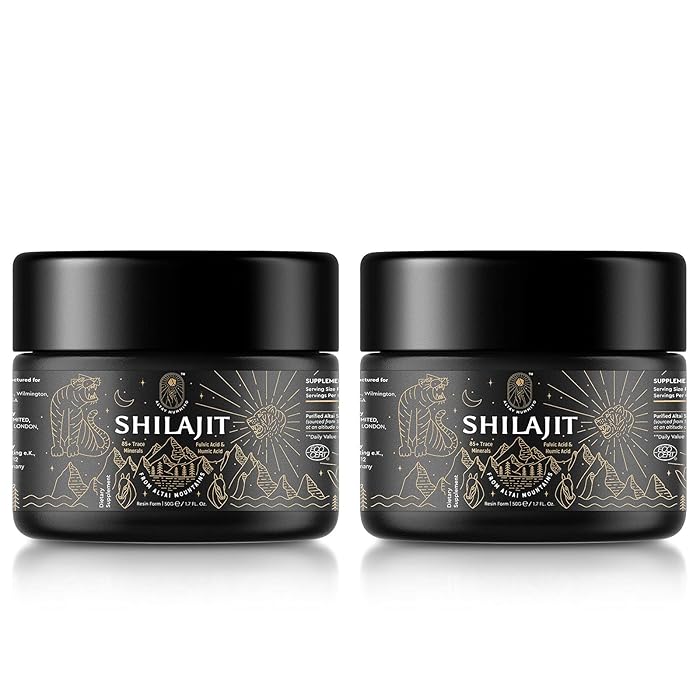
Locate an element on the screen. The height and width of the screenshot is (700, 700). jar is located at coordinates (453, 285).